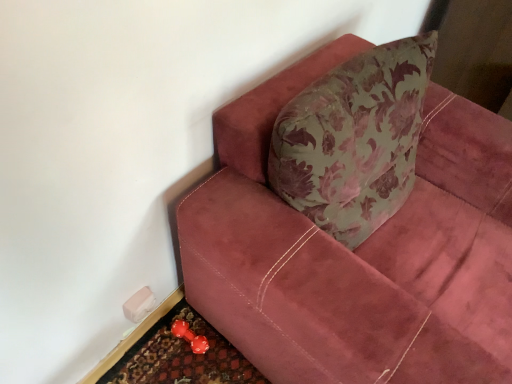
Question: From the image's perspective, is rubberized red doormat at lower left below velvet maroon couch at upper right?

Choices:
 (A) yes
 (B) no

Answer: (A)

Question: Considering the relative sizes of rubberized red doormat at lower left and velvet maroon couch at upper right in the image provided, is rubberized red doormat at lower left bigger than velvet maroon couch at upper right?

Choices:
 (A) yes
 (B) no

Answer: (B)

Question: Is rubberized red doormat at lower left not near velvet maroon couch at upper right?

Choices:
 (A) no
 (B) yes

Answer: (A)

Question: Is rubberized red doormat at lower left surrounding velvet maroon couch at upper right?

Choices:
 (A) yes
 (B) no

Answer: (B)

Question: Considering the relative sizes of rubberized red doormat at lower left and velvet maroon couch at upper right in the image provided, is rubberized red doormat at lower left wider than velvet maroon couch at upper right?

Choices:
 (A) yes
 (B) no

Answer: (B)

Question: Can you confirm if rubberized red doormat at lower left is positioned to the left of velvet maroon couch at upper right?

Choices:
 (A) no
 (B) yes

Answer: (B)

Question: From a real-world perspective, is rubberized red dumbbell at lower left over velvet maroon couch at upper right?

Choices:
 (A) no
 (B) yes

Answer: (A)

Question: Is rubberized red dumbbell at lower left bigger than velvet maroon couch at upper right?

Choices:
 (A) no
 (B) yes

Answer: (A)

Question: Can you confirm if rubberized red dumbbell at lower left is taller than velvet maroon couch at upper right?

Choices:
 (A) yes
 (B) no

Answer: (B)

Question: Is rubberized red dumbbell at lower left oriented away from velvet maroon couch at upper right?

Choices:
 (A) yes
 (B) no

Answer: (B)

Question: Is rubberized red dumbbell at lower left to the left of velvet maroon couch at upper right from the viewer's perspective?

Choices:
 (A) yes
 (B) no

Answer: (A)

Question: From the image's perspective, would you say rubberized red dumbbell at lower left is shown under velvet maroon couch at upper right?

Choices:
 (A) no
 (B) yes

Answer: (B)

Question: From a real-world perspective, does rubberized red doormat at lower left sit lower than rubberized red dumbbell at lower left?

Choices:
 (A) no
 (B) yes

Answer: (B)